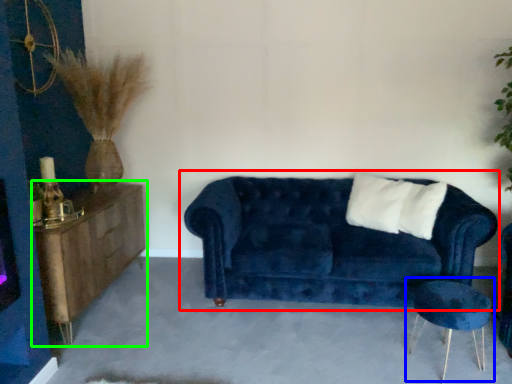
Question: Which object is positioned closest to studio couch (highlighted by a red box)? Select from side table (highlighted by a blue box) and dresser (highlighted by a green box).

Choices:
 (A) side table
 (B) dresser

Answer: (A)